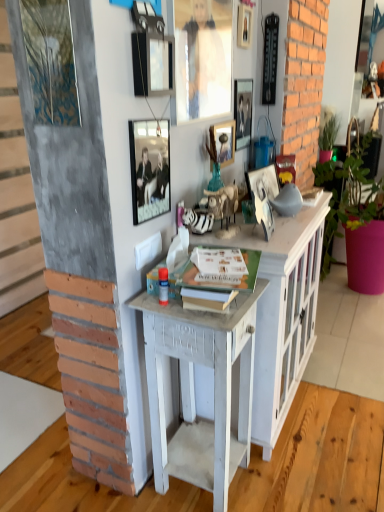
Identify the location of vacant space to the right of metallic silver picture frame at center, acting as the 1th picture frame starting from the right. (291, 232).